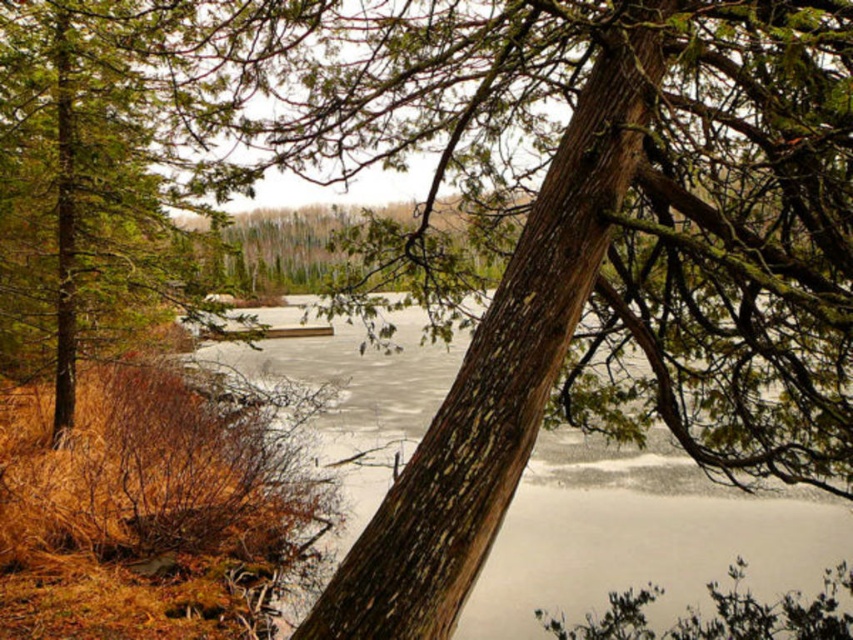
You are standing at the edge of the water in this serene natural scene. There is a point labeled as point [641,534]. Based on the description, what is located at that point?

The point [641,534] corresponds to frozen ice at center.